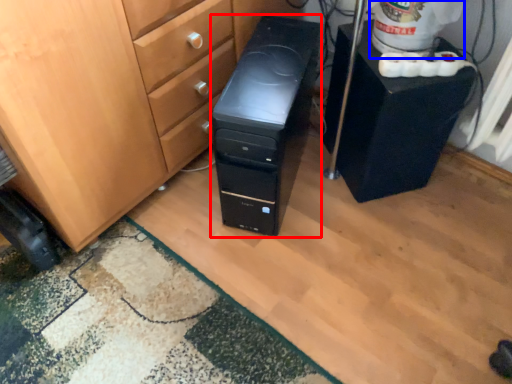
Question: Which object appears farthest to the camera in this image, computer tower (highlighted by a red box) or water cooler (highlighted by a blue box)?

Choices:
 (A) computer tower
 (B) water cooler

Answer: (B)